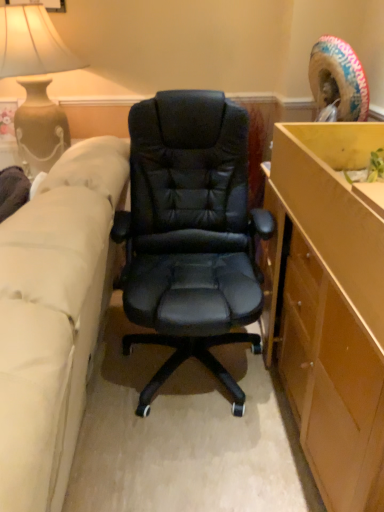
This screenshot has height=512, width=384. In order to click on beige fabric couch at left in this screenshot , I will do `click(53, 317)`.

What do you see at coordinates (53, 317) in the screenshot?
I see `beige fabric couch at left` at bounding box center [53, 317].

From the picture: What is the approximate width of matte beige vase at upper left?

23.13 inches.

Measure the distance between point (21,46) and camera.

They are 6.49 feet apart.

Locate an element on the screen. matte beige vase at upper left is located at coordinates (32, 42).

The width and height of the screenshot is (384, 512). Describe the element at coordinates (32, 42) in the screenshot. I see `matte beige vase at upper left` at that location.

You are a GUI agent. You are given a task and a screenshot of the screen. Output one action in this format:
    pyautogui.click(x=<x>, y=<y>)
    Task: Click on the beige fabric couch at left
    
    Given the screenshot: What is the action you would take?
    pyautogui.click(x=53, y=317)

Which object is positioned more to the right, matte beige vase at upper left or beige fabric couch at left?

beige fabric couch at left is more to the right.

In the scene shown: Considering the positions of objects matte beige vase at upper left and beige fabric couch at left in the image provided, who is in front, matte beige vase at upper left or beige fabric couch at left?

beige fabric couch at left is in front.

Considering the points (6, 46) and (40, 378), which point is behind, point (6, 46) or point (40, 378)?

Positioned behind is point (6, 46).

Consider the image. From the image's perspective, relative to beige fabric couch at left, is matte beige vase at upper left above or below?

matte beige vase at upper left is above beige fabric couch at left.

From a real-world perspective, who is located lower, matte beige vase at upper left or beige fabric couch at left?

beige fabric couch at left.

In terms of width, does matte beige vase at upper left look wider or thinner when compared to beige fabric couch at left?

Clearly, matte beige vase at upper left has less width compared to beige fabric couch at left.

Considering the sizes of objects matte beige vase at upper left and beige fabric couch at left in the image provided, who is taller, matte beige vase at upper left or beige fabric couch at left?

beige fabric couch at left is taller.

Who is bigger, matte beige vase at upper left or beige fabric couch at left?

beige fabric couch at left is bigger.

Is matte beige vase at upper left inside or outside of beige fabric couch at left?

matte beige vase at upper left is outside beige fabric couch at left.

Is matte beige vase at upper left in contact with beige fabric couch at left?

matte beige vase at upper left is not next to beige fabric couch at left, and they're not touching.

Is matte beige vase at upper left oriented towards beige fabric couch at left?

Yes, matte beige vase at upper left is turned towards beige fabric couch at left.

Measure the distance between matte beige vase at upper left and beige fabric couch at left.

matte beige vase at upper left is 35.93 inches from beige fabric couch at left.

This screenshot has height=512, width=384. I want to click on studio couch located in front of the matte beige vase at upper left, so click(x=53, y=317).

Is beige fabric couch at left to the left or to the right of matte beige vase at upper left in the image?

Based on their positions, beige fabric couch at left is located to the right of matte beige vase at upper left.

Is the depth of beige fabric couch at left greater than that of matte beige vase at upper left?

No, the depth of beige fabric couch at left is less than that of matte beige vase at upper left.

Is point (64, 293) closer or farther from the camera than point (48, 122)?

Point (64, 293) is positioned closer to the camera compared to point (48, 122).

From the image's perspective, is beige fabric couch at left beneath matte beige vase at upper left?

Yes, from the image's perspective, beige fabric couch at left is beneath matte beige vase at upper left.

From a real-world perspective, between beige fabric couch at left and matte beige vase at upper left, who is vertically higher?

matte beige vase at upper left is physically above.

In terms of width, does beige fabric couch at left look wider or thinner when compared to matte beige vase at upper left?

In the image, beige fabric couch at left appears to be wider than matte beige vase at upper left.

Does beige fabric couch at left have a lesser height compared to matte beige vase at upper left?

Incorrect, the height of beige fabric couch at left does not fall short of that of matte beige vase at upper left.

Based on their sizes in the image, would you say beige fabric couch at left is bigger or smaller than matte beige vase at upper left?

beige fabric couch at left is bigger than matte beige vase at upper left.

Would you say beige fabric couch at left is outside matte beige vase at upper left?

Yes, beige fabric couch at left is located beyond the bounds of matte beige vase at upper left.

Are beige fabric couch at left and matte beige vase at upper left making contact?

No.

Is beige fabric couch at left oriented away from matte beige vase at upper left?

No, beige fabric couch at left is not facing the opposite direction of matte beige vase at upper left.

How different are the orientations of beige fabric couch at left and matte beige vase at upper left in degrees?

There is a 90-degree angle between the facing directions of beige fabric couch at left and matte beige vase at upper left.

How distant is beige fabric couch at left from matte beige vase at upper left?

35.93 inches.

Locate an element on the screen. The image size is (384, 512). studio couch in front of the matte beige vase at upper left is located at coordinates (53, 317).

The height and width of the screenshot is (512, 384). Find the location of `studio couch that appears below the matte beige vase at upper left (from a real-world perspective)`. studio couch that appears below the matte beige vase at upper left (from a real-world perspective) is located at coordinates (53, 317).

At what (x,y) coordinates should I click in order to perform the action: click on lamp located on the left of beige fabric couch at left. Please return your answer as a coordinate pair (x, y). The image size is (384, 512). Looking at the image, I should click on (32, 42).